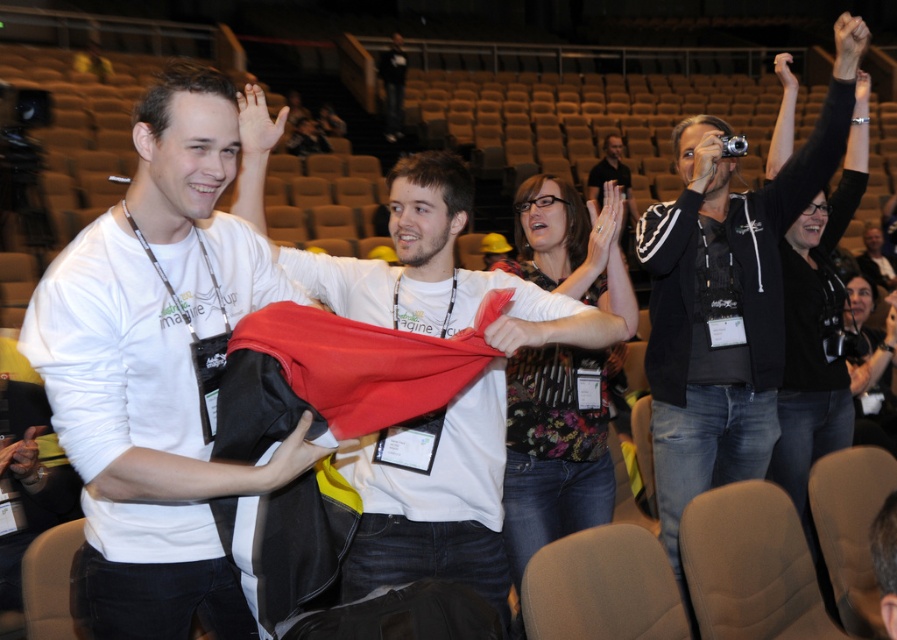
Question: Based on their relative distances, which object is nearer to the white matte t-shirt at center?

Choices:
 (A) white matte t-shirt at left
 (B) matte black jacket at center
 (C) black hoodie at upper right

Answer: (A)

Question: Which object is closer to the camera taking this photo?

Choices:
 (A) black hoodie at upper right
 (B) white matte t-shirt at center
 (C) matte black jacket at center
 (D) white matte t-shirt at left

Answer: (D)

Question: Is white matte t-shirt at left positioned at the back of white matte t-shirt at center?

Choices:
 (A) no
 (B) yes

Answer: (A)

Question: Is white matte t-shirt at left smaller than matte black jacket at center?

Choices:
 (A) yes
 (B) no

Answer: (A)

Question: Which of these objects is positioned farthest from the white matte t-shirt at left?

Choices:
 (A) black hoodie at upper right
 (B) white matte t-shirt at center

Answer: (A)

Question: Can you confirm if white matte t-shirt at left is smaller than matte black jacket at center?

Choices:
 (A) no
 (B) yes

Answer: (B)